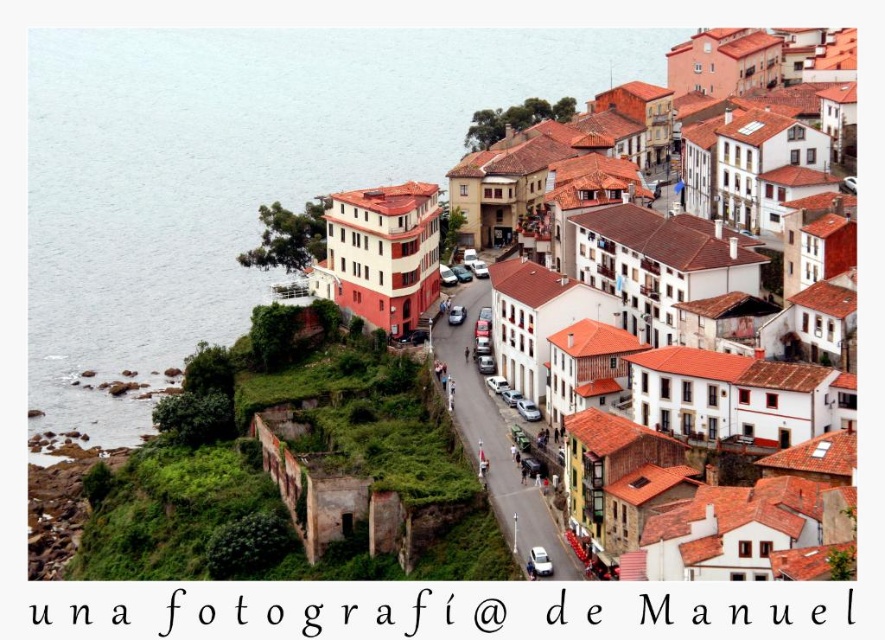
You are a tourist standing on the grassy area above the street in the coastal town. You see the blue water at left and the white matte building at center. Which one is bigger in size?

The blue water at left is larger in size compared to the white matte building at center according to the description.

You are a tourist standing on the grassy area above the street. You want to take a photo of the white stucco buildings at center and the blue water at left. Which object should you frame first in your camera to ensure both are in the shot?

The white stucco buildings at center should be framed first since the blue water at left is 118.45 meters away from them, meaning the water is further away and might require adjusting the camera angle to include both in the frame.

You are standing on the grassy area above the narrow street in the coastal town. You see the blue water at left and the white stucco buildings at center. Which one is higher in elevation?

The blue water at left is above white stucco buildings at center, so the blue water at left is higher in elevation.